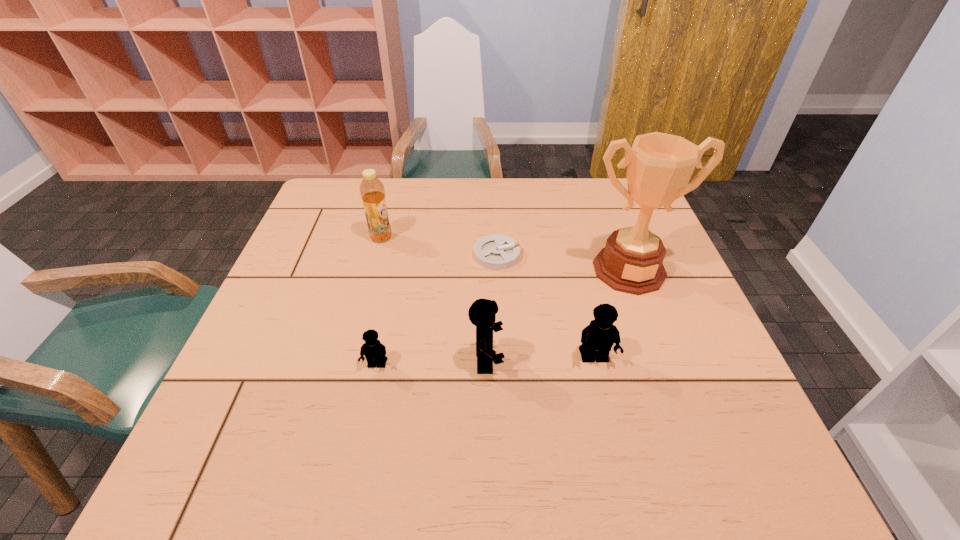
Identify the location of vacant space at the far left corner of the desktop. (331, 218).

Locate an element on the screen. free location at the near left corner is located at coordinates 284,396.

This screenshot has width=960, height=540. Find the location of `vacant area at the near right corner`. vacant area at the near right corner is located at coordinates (709, 404).

Where is `free area in between the second Lego from right to left and the award`? The width and height of the screenshot is (960, 540). free area in between the second Lego from right to left and the award is located at coordinates (558, 316).

You are a GUI agent. You are given a task and a screenshot of the screen. Output one action in this format:
    pyautogui.click(x=<x>, y=<y>)
    Task: Click on the free spot between the bottle and the second object from left to right
    This screenshot has width=960, height=540.
    Given the screenshot: What is the action you would take?
    pyautogui.click(x=379, y=301)

The image size is (960, 540). Find the location of `free point between the leftmost object and the second Lego from right to left`. free point between the leftmost object and the second Lego from right to left is located at coordinates 434,299.

In order to click on free spot between the shortest Lego and the second tallest object in this screenshot , I will do `click(379, 301)`.

At what (x,y) coordinates should I click in order to perform the action: click on blank region between the shortest object and the fourth tallest object. Please return your answer as a coordinate pair (x, y). The width and height of the screenshot is (960, 540). Looking at the image, I should click on click(545, 307).

The height and width of the screenshot is (540, 960). I want to click on vacant area between the second Lego from right to left and the fifth shortest object, so click(x=434, y=299).

I want to click on the third closest object relative to the ashtray, so click(x=482, y=313).